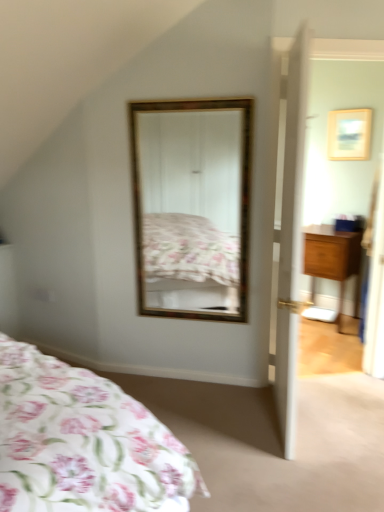
The width and height of the screenshot is (384, 512). Describe the element at coordinates (192, 207) in the screenshot. I see `gold-framed mirror at center` at that location.

Find the location of a particular element. The height and width of the screenshot is (512, 384). gold-framed mirror at center is located at coordinates (192, 207).

The height and width of the screenshot is (512, 384). What do you see at coordinates (291, 239) in the screenshot?
I see `white wooden door at right` at bounding box center [291, 239].

Locate an element on the screen. Image resolution: width=384 pixels, height=512 pixels. gold-framed mirror at center is located at coordinates (192, 207).

Considering the relative sizes of wooden picture frame at upper right and white wooden door at right in the image provided, is wooden picture frame at upper right smaller than white wooden door at right?

Indeed, wooden picture frame at upper right has a smaller size compared to white wooden door at right.

Does point (345, 136) come in front of point (288, 223)?

No, (345, 136) is further to viewer.

From a real-world perspective, is wooden picture frame at upper right positioned above or below white wooden door at right?

In terms of real-world spatial position, wooden picture frame at upper right is above white wooden door at right.

Measure the distance from wooden nightstand at right to wooden picture frame at upper right.

wooden nightstand at right is 33.59 inches away from wooden picture frame at upper right.

Can you confirm if wooden nightstand at right is wider than wooden picture frame at upper right?

Correct, the width of wooden nightstand at right exceeds that of wooden picture frame at upper right.

Is wooden nightstand at right bigger than wooden picture frame at upper right?

Indeed, wooden nightstand at right has a larger size compared to wooden picture frame at upper right.

Is wooden nightstand at right completely or partially outside of wooden picture frame at upper right?

Indeed, wooden nightstand at right is completely outside wooden picture frame at upper right.

Does point (166, 114) come farther from viewer compared to point (348, 239)?

No, it is not.

Considering their positions, is gold-framed mirror at center located in front of or behind wooden nightstand at right?

gold-framed mirror at center is in front of wooden nightstand at right.

From a real-world perspective, is gold-framed mirror at center on top of wooden nightstand at right?

Correct, in the physical world, gold-framed mirror at center is higher than wooden nightstand at right.

From the picture: From the image's perspective, between gold-framed mirror at center and wooden nightstand at right, who is located below?

wooden nightstand at right is shown below in the image.

At what (x,y) coordinates should I click in order to perform the action: click on picture frame located on the right of gold-framed mirror at center. Please return your answer as a coordinate pair (x, y). The width and height of the screenshot is (384, 512). Looking at the image, I should click on (349, 134).

In terms of height, does gold-framed mirror at center look taller or shorter compared to wooden picture frame at upper right?

Clearly, gold-framed mirror at center is taller compared to wooden picture frame at upper right.

Considering the points (164, 271) and (361, 158), which point is in front, point (164, 271) or point (361, 158)?

Point (361, 158)

Between gold-framed mirror at center and wooden picture frame at upper right, which one has larger size?

Bigger between the two is gold-framed mirror at center.

Who is taller, wooden picture frame at upper right or gold-framed mirror at center?

gold-framed mirror at center is taller.

Is wooden picture frame at upper right turned away from gold-framed mirror at center?

No, wooden picture frame at upper right is not facing away from gold-framed mirror at center.

Is wooden picture frame at upper right spatially inside gold-framed mirror at center, or outside of it?

wooden picture frame at upper right is not inside gold-framed mirror at center, it's outside.

Is wooden picture frame at upper right beside gold-framed mirror at center?

No, wooden picture frame at upper right is not with gold-framed mirror at center.

Does white wooden door at right turn towards gold-framed mirror at center?

No, white wooden door at right is not facing towards gold-framed mirror at center.

In the scene shown: Can you confirm if white wooden door at right is bigger than gold-framed mirror at center?

Yes, white wooden door at right is bigger than gold-framed mirror at center.

How different are the orientations of white wooden door at right and gold-framed mirror at center in degrees?

94.4 degrees separate the facing orientations of white wooden door at right and gold-framed mirror at center.

From the image's perspective, which one is positioned higher, white wooden door at right or gold-framed mirror at center?

gold-framed mirror at center, from the image's perspective.

Considering the relative positions of wooden nightstand at right and gold-framed mirror at center in the image provided, is wooden nightstand at right in front of gold-framed mirror at center?

No.

Is wooden nightstand at right smaller than gold-framed mirror at center?

No.

Is wooden nightstand at right not inside gold-framed mirror at center?

Yes, wooden nightstand at right is located beyond the bounds of gold-framed mirror at center.

Locate an element on the screen. The image size is (384, 512). picture frame above the white wooden door at right (from the image's perspective) is located at coordinates (349, 134).

Where is `picture frame located on the right of wooden nightstand at right`? This screenshot has width=384, height=512. picture frame located on the right of wooden nightstand at right is located at coordinates (349, 134).

Consider the image. Looking at the image, which one is located closer to white wooden door at right, gold-framed mirror at center or wooden nightstand at right?

Among the two, gold-framed mirror at center is located nearer to white wooden door at right.

Based on their spatial positions, is wooden picture frame at upper right or wooden nightstand at right further from gold-framed mirror at center?

wooden picture frame at upper right is positioned further to the anchor gold-framed mirror at center.

Based on their spatial positions, is white wooden door at right or gold-framed mirror at center closer to wooden nightstand at right?

gold-framed mirror at center lies closer to wooden nightstand at right than the other object.

From the image, which object appears to be farther from wooden nightstand at right, wooden picture frame at upper right or white wooden door at right?

white wooden door at right is positioned further to the anchor wooden nightstand at right.

From the image, which object appears to be farther from gold-framed mirror at center, white wooden door at right or wooden picture frame at upper right?

wooden picture frame at upper right lies further to gold-framed mirror at center than the other object.

Estimate the real-world distances between objects in this image. Which object is closer to wooden picture frame at upper right, gold-framed mirror at center or white wooden door at right?

Based on the image, gold-framed mirror at center appears to be nearer to wooden picture frame at upper right.

When comparing their distances from white wooden door at right, does wooden nightstand at right or wooden picture frame at upper right seem closer?

wooden nightstand at right is positioned closer to the anchor white wooden door at right.

From the image, which object appears to be nearer to wooden nightstand at right, gold-framed mirror at center or wooden picture frame at upper right?

wooden picture frame at upper right.

The height and width of the screenshot is (512, 384). Find the location of `mirror located between white wooden door at right and wooden picture frame at upper right in the depth direction`. mirror located between white wooden door at right and wooden picture frame at upper right in the depth direction is located at coordinates (192, 207).

At what (x,y) coordinates should I click in order to perform the action: click on mirror positioned between white wooden door at right and wooden nightstand at right from near to far. Please return your answer as a coordinate pair (x, y). Looking at the image, I should click on (192, 207).

At what (x,y) coordinates should I click in order to perform the action: click on nightstand between white wooden door at right and wooden picture frame at upper right along the z-axis. Please return your answer as a coordinate pair (x, y). The height and width of the screenshot is (512, 384). Looking at the image, I should click on (333, 261).

Locate an element on the screen. The image size is (384, 512). nightstand between gold-framed mirror at center and wooden picture frame at upper right is located at coordinates (333, 261).